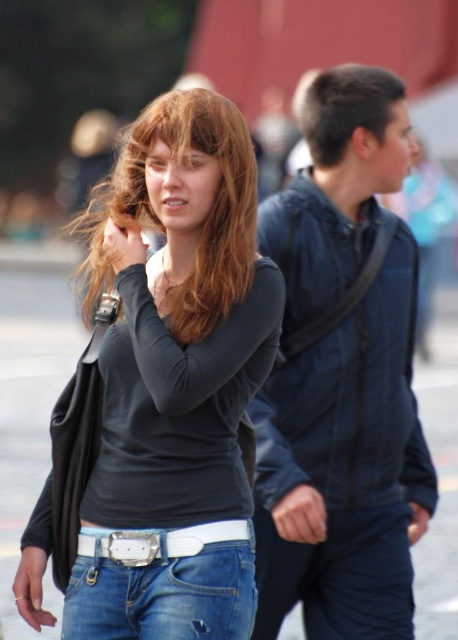
You are a fashion designer observing the two items in the image. You need to determine if the distance between the denim jeans at lower center and the white matte belt at lower center is sufficient to accommodate a new accessory that requires 5 inches of space between them. Can you confirm if there is enough space?

The distance between the denim jeans at lower center and the white matte belt at lower center is 4.28 inches. Since the required space is 5 inches, there is not enough space to accommodate the accessory.

You are a photographer trying to capture a candid shot of two people in the scene described. You want to ensure both the matte black shirt at center and the dark blue jacket at center are visible in the frame. Based on their positions, which one should you focus on first to include both in the shot?

The matte black shirt at center is positioned on the left side of dark blue jacket at center, so focusing on the matte black shirt at center first would allow you to frame both objects since it is closer to the edge of the potential shot area.